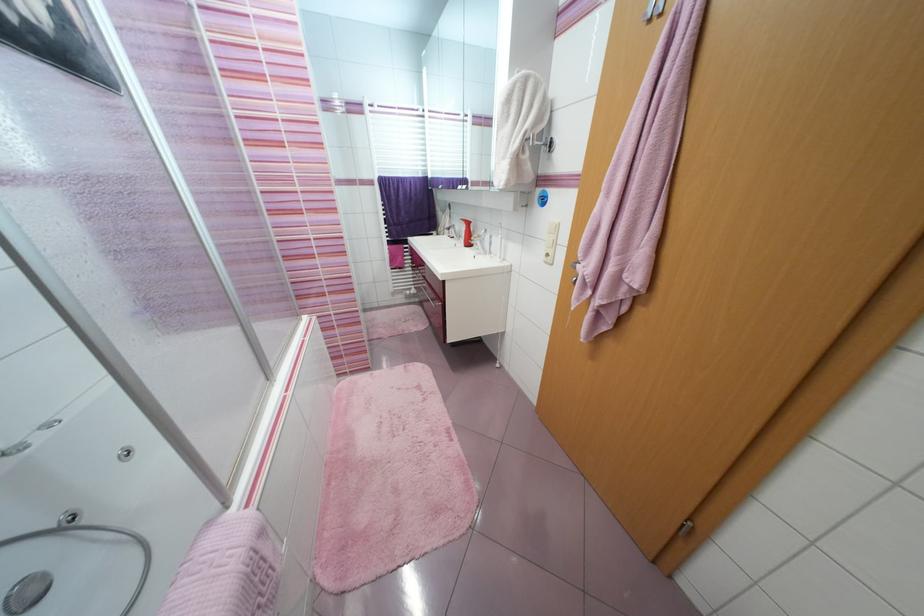
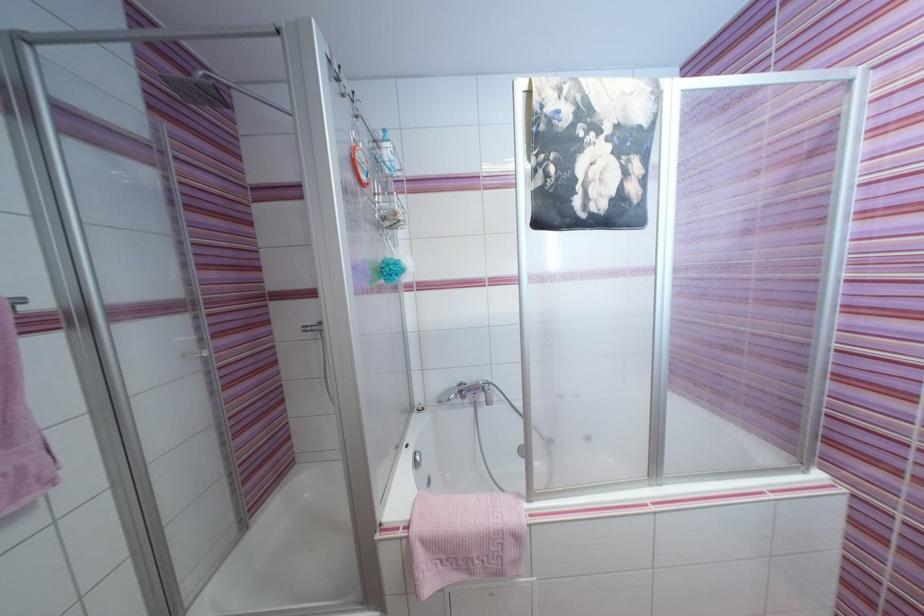
In the second image, find the point that corresponds to point 266,535 in the first image.

(521, 539)